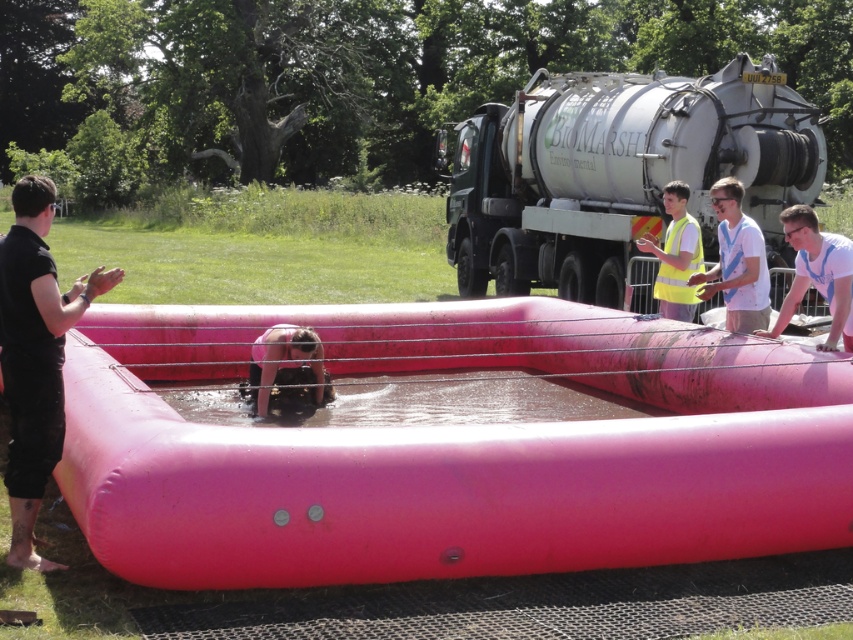
Can you confirm if rubber/inflatable raft at center is wider than white t-shirt at upper right?

Indeed, rubber/inflatable raft at center has a greater width compared to white t-shirt at upper right.

Looking at this image, who is lower down, rubber/inflatable raft at center or white t-shirt at upper right?

Positioned lower is rubber/inflatable raft at center.

Identify the location of rubber/inflatable raft at center. (451, 445).

Does gray metallic tanker truck at upper center come in front of yellow reflective safety vest at right?

That is False.

From the picture: Does gray metallic tanker truck at upper center appear under yellow reflective safety vest at right?

No, gray metallic tanker truck at upper center is not below yellow reflective safety vest at right.

Who is more forward, (627,84) or (677,244)?

Point (677,244) is more forward.

This screenshot has width=853, height=640. Identify the location of gray metallic tanker truck at upper center. (618, 172).

Who is more forward, (x=799, y=173) or (x=33, y=208)?

Point (x=33, y=208) is more forward.

Does gray metallic tanker truck at upper center appear under black matte shirt at left?

No, gray metallic tanker truck at upper center is not below black matte shirt at left.

You are a GUI agent. You are given a task and a screenshot of the screen. Output one action in this format:
    pyautogui.click(x=<x>, y=<y>)
    Task: Click on the gray metallic tanker truck at upper center
    Image resolution: width=853 pixels, height=640 pixels.
    Given the screenshot: What is the action you would take?
    pyautogui.click(x=618, y=172)

The height and width of the screenshot is (640, 853). Find the location of `gray metallic tanker truck at upper center`. gray metallic tanker truck at upper center is located at coordinates (618, 172).